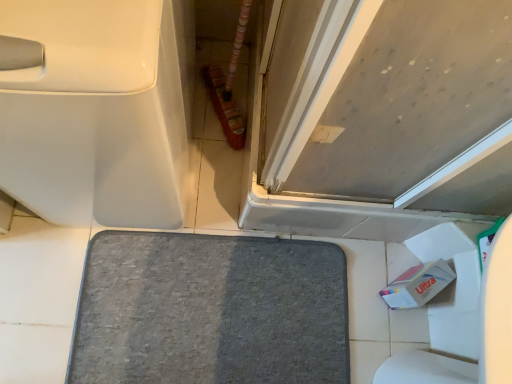
Question: From their relative heights in the image, would you say white glossy toilet at left is taller or shorter than gray soft carpet at center?

Choices:
 (A) short
 (B) tall

Answer: (B)

Question: Considering the positions of white glossy toilet at left and gray soft carpet at center in the image, is white glossy toilet at left wider or thinner than gray soft carpet at center?

Choices:
 (A) thin
 (B) wide

Answer: (B)

Question: Based on their relative distances, which object is farther from the gray soft carpet at center?

Choices:
 (A) white glossy toilet at left
 (B) matte gray door at upper right

Answer: (A)

Question: Estimate the real-world distances between objects in this image. Which object is farther from the matte gray door at upper right?

Choices:
 (A) gray soft carpet at center
 (B) white glossy toilet at left

Answer: (A)